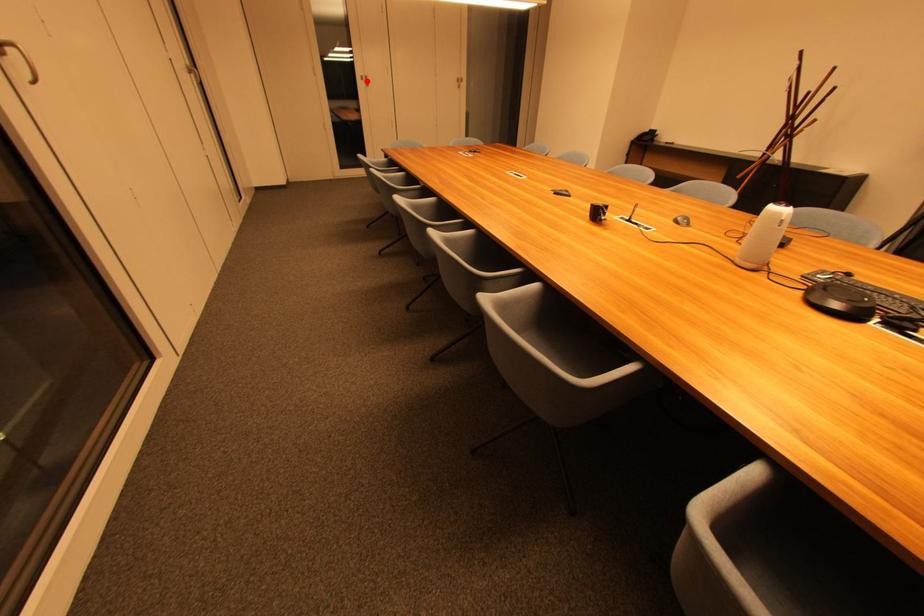
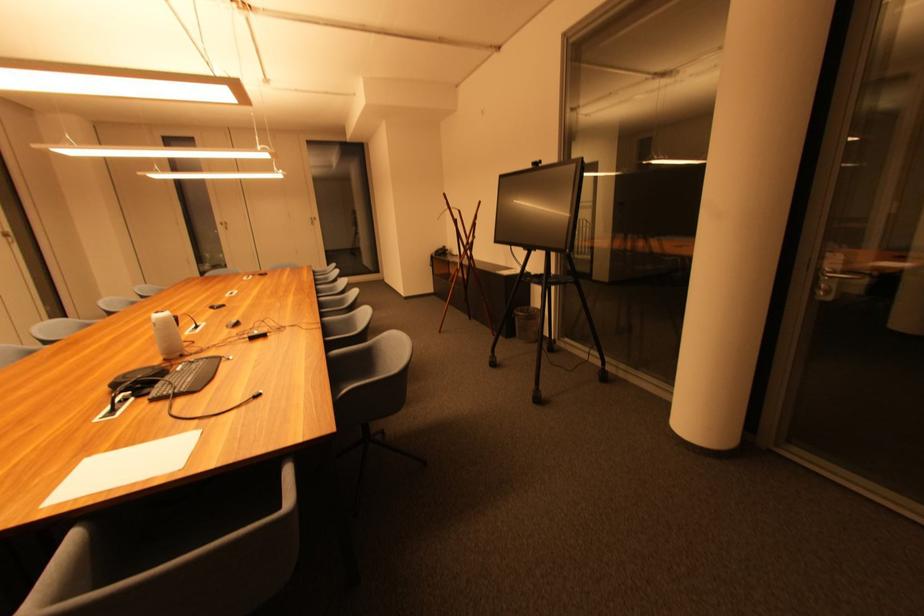
Question: I am providing you with two images of the same scene from different viewpoints. In image1, a red point is highlighted. Considering the same 3D point in image2, which of the following is correct?

Choices:
 (A) It is closer
 (B) It is farther

Answer: (B)